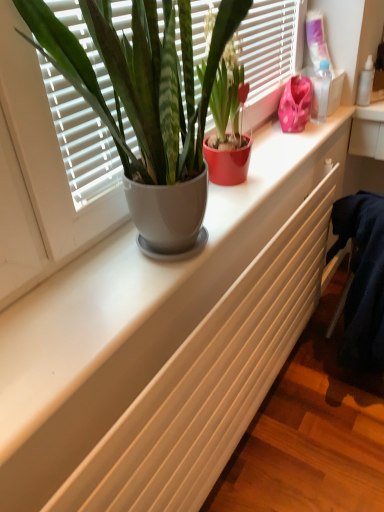
I want to click on free spot to the right of matte ceramic pot at center, arranged as the 1th houseplant when viewed from the right, so click(x=278, y=167).